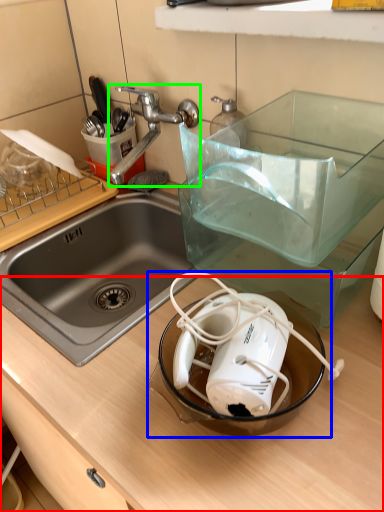
Question: Estimate the real-world distances between objects in this image. Which object is closer to counter top (highlighted by a red box), appliance (highlighted by a blue box) or tap (highlighted by a green box)?

Choices:
 (A) appliance
 (B) tap

Answer: (A)